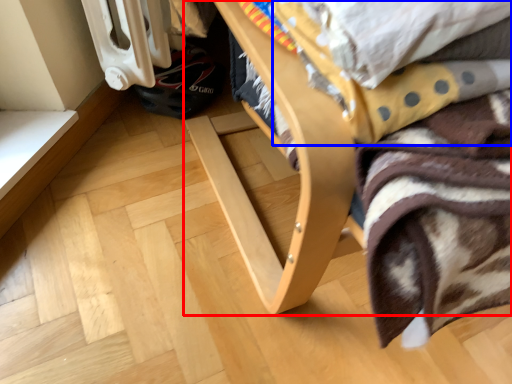
Question: Which object appears closest to the camera in this image, furniture (highlighted by a red box) or blanket (highlighted by a blue box)?

Choices:
 (A) furniture
 (B) blanket

Answer: (A)